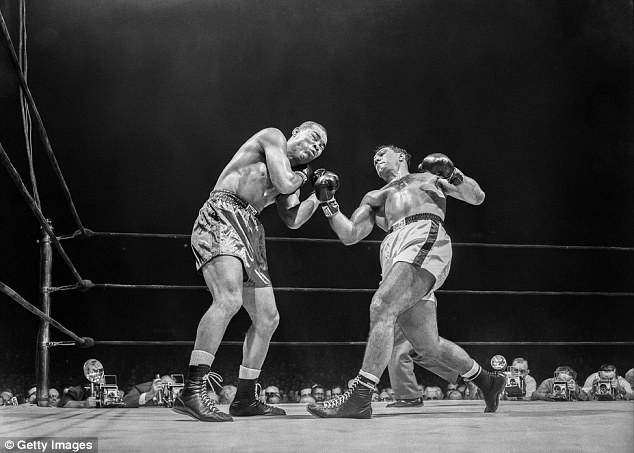
Where is `ring mat`? ring mat is located at coordinates (552, 430).